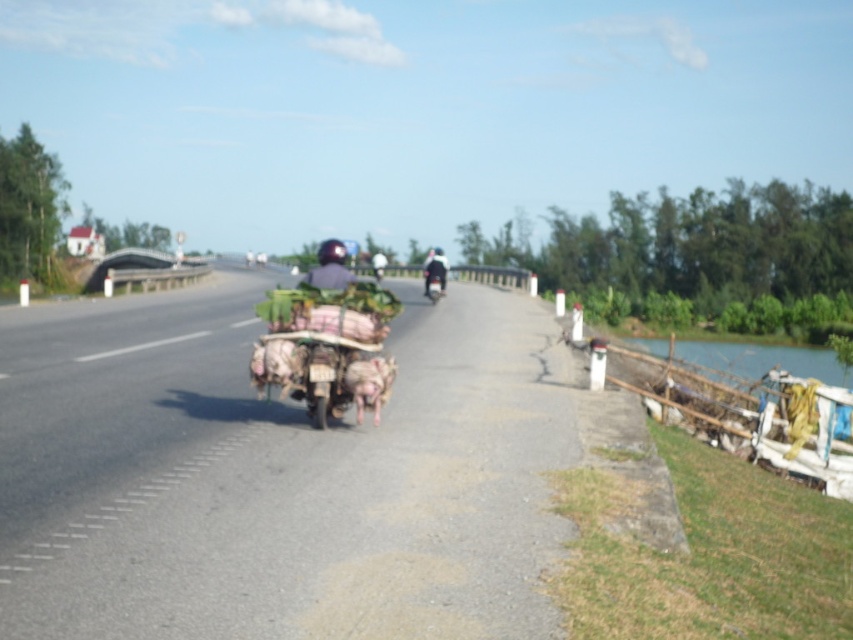
Locate an element on the screen. metallic silver motorcycle at center is located at coordinates (434, 269).

Which is more to the right, metallic silver motorcycle at center or shiny black motorcycle at center?

metallic silver motorcycle at center is more to the right.

Image resolution: width=853 pixels, height=640 pixels. Describe the element at coordinates (434, 269) in the screenshot. I see `metallic silver motorcycle at center` at that location.

The height and width of the screenshot is (640, 853). I want to click on metallic silver motorcycle at center, so click(434, 269).

Does rusty metal cart at center appear on the right side of shiny black motorcycle at center?

Incorrect, rusty metal cart at center is not on the right side of shiny black motorcycle at center.

Who is shorter, rusty metal cart at center or shiny black motorcycle at center?

shiny black motorcycle at center is shorter.

Is point (318, 317) positioned in front of point (437, 284)?

Yes, it is.

The height and width of the screenshot is (640, 853). Find the location of `rusty metal cart at center`. rusty metal cart at center is located at coordinates (326, 348).

Consider the image. Is rusty metal cart at center shorter than metallic silver motorcycle at center?

Yes, rusty metal cart at center is shorter than metallic silver motorcycle at center.

Does point (325, 424) come farther from viewer compared to point (428, 278)?

No.

Is point (276, 344) positioned behind point (428, 291)?

No, it is not.

This screenshot has width=853, height=640. I want to click on rusty metal cart at center, so click(x=326, y=348).